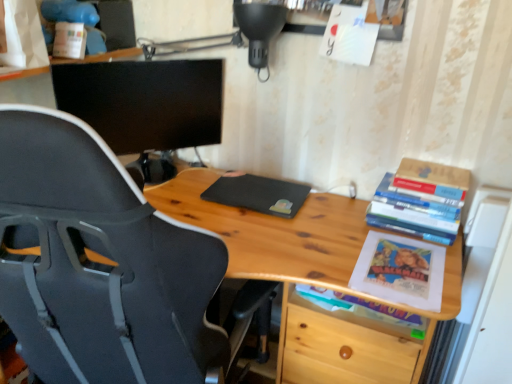
This screenshot has width=512, height=384. I want to click on free space between black matte laptop at center and hardcover books at right, which appears as the 2th book when viewed from the top, so pos(343,216).